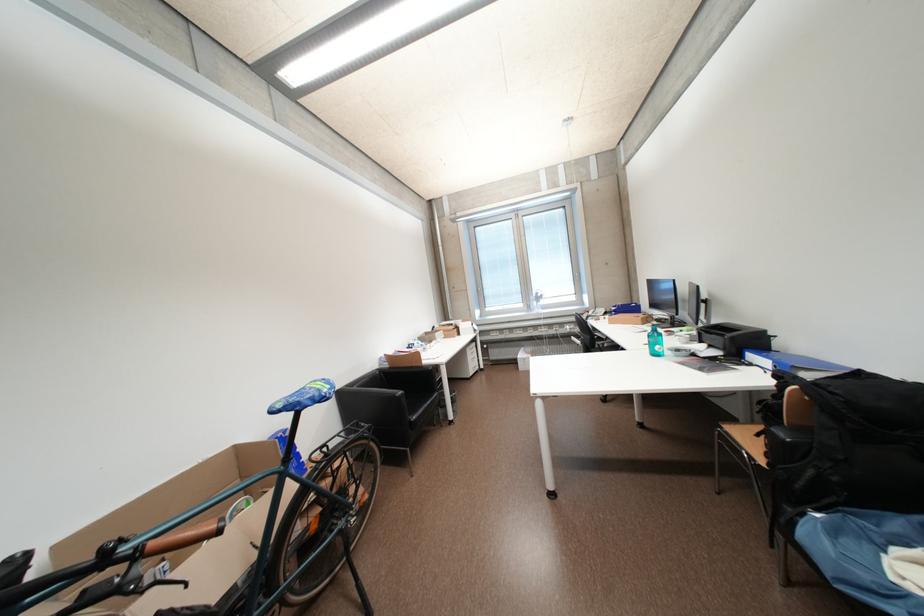
Find the location of `brown bicycle grip`. brown bicycle grip is located at coordinates (184, 538).